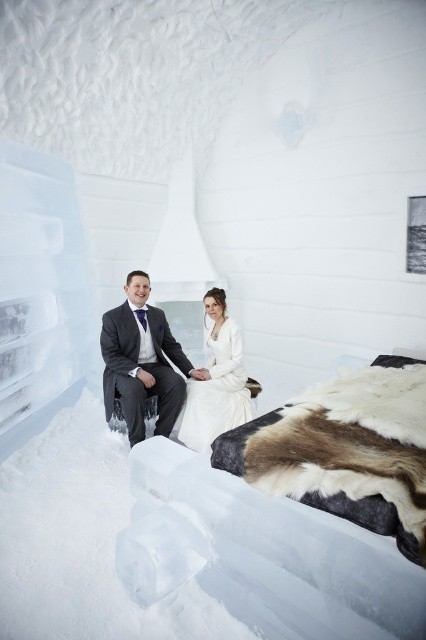
You are a photographer taking a picture of the matte gray suit at left and the white satin dress at center in an ice hotel room. Which object is positioned closer to the camera?

The matte gray suit at left is closer to the viewer than the white satin dress at center, so the matte gray suit at left would be closer to the camera.

You are a photographer setting up for a wedding photo shoot in an ice hotel room. You have two outfits to feature in the shot. The matte gray suit at left and the white satin dress at center. The client wants to know which outfit takes up more horizontal space. Based on the scene description, which outfit is wider?

The matte gray suit at left is wider than the white satin dress at center, as the description states that the matte gray suit at left surpasses the white satin dress at center in width.

You are a photographer setting up for a wedding photo shoot in an ice hotel room. You have two outfits to photograph today. The first is the matte gray suit at left and the second is the white satin dress at center. The camera you are using has a limited focus range. Which outfit should you prioritize photographing first to ensure proper focus, considering their sizes?

The matte gray suit at left is larger in size than the white satin dress at center. Since the camera has a limited focus range, it is advisable to photograph the larger matte gray suit at left first to ensure proper focus, as larger objects may require adjustments that could affect the focus settings for smaller items.